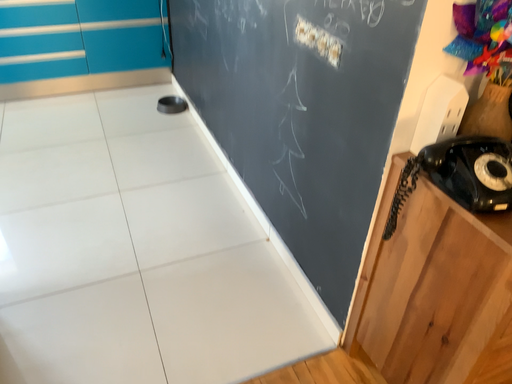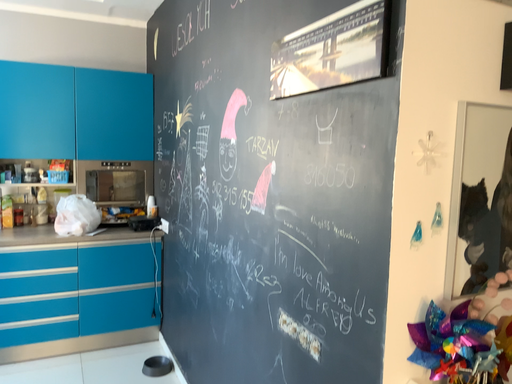
Question: How did the camera likely rotate when shooting the video?

Choices:
 (A) rotated downward
 (B) rotated upward

Answer: (B)